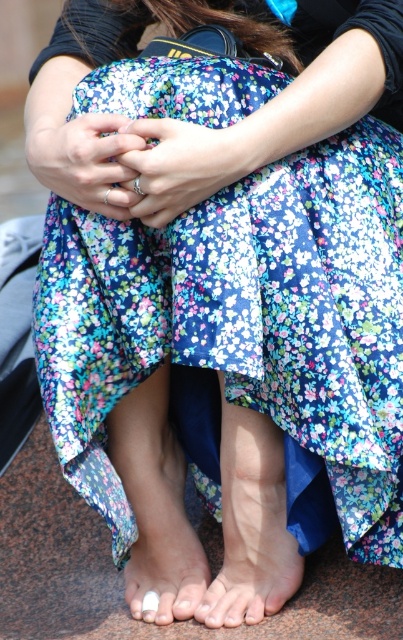
Question: Is floral fabric dress at center closer to camera compared to dry skin foot at lower center?

Choices:
 (A) no
 (B) yes

Answer: (B)

Question: Based on their relative distances, which object is nearer to the white matte nail at center?

Choices:
 (A) dry skin foot at lower center
 (B) floral fabric dress at center

Answer: (A)

Question: Among these points, which one is farthest from the camera?

Choices:
 (A) click(x=155, y=301)
 (B) click(x=253, y=584)

Answer: (B)

Question: Does dry skin foot at lower center have a larger size compared to white matte nail at center?

Choices:
 (A) no
 (B) yes

Answer: (B)

Question: Which is nearer to the dry skin foot at lower center?

Choices:
 (A) white matte nail at center
 (B) floral fabric dress at center

Answer: (A)

Question: Is floral fabric dress at center to the left of white matte nail at center from the viewer's perspective?

Choices:
 (A) no
 (B) yes

Answer: (A)